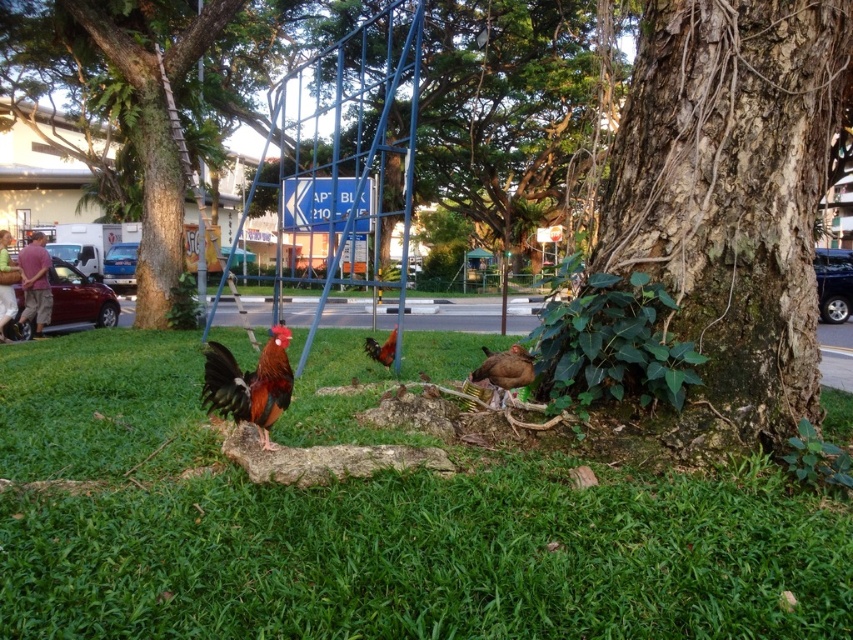
Does brown matte chicken at lower center have a lesser height compared to brown glossy chicken at center?

No, brown matte chicken at lower center is not shorter than brown glossy chicken at center.

Between point (490, 376) and point (393, 342), which one is positioned in front?

Point (490, 376) is more forward.

The height and width of the screenshot is (640, 853). Find the location of `brown matte chicken at lower center`. brown matte chicken at lower center is located at coordinates (503, 371).

Which is behind, point (144, 72) or point (495, 394)?

Positioned behind is point (144, 72).

Who is positioned more to the left, smooth brown tree trunk at left or brown matte chicken at lower center?

smooth brown tree trunk at left is more to the left.

Does point (155, 99) come farther from viewer compared to point (506, 349)?

Yes, point (155, 99) is farther from viewer.

The image size is (853, 640). Identify the location of smooth brown tree trunk at left. (160, 198).

Who is lower down, smooth bark tree at lower right or smooth brown tree trunk at left?

smooth bark tree at lower right is below.

Describe the element at coordinates (729, 202) in the screenshot. I see `smooth bark tree at lower right` at that location.

This screenshot has height=640, width=853. In order to click on smooth bark tree at lower right in this screenshot , I will do `click(729, 202)`.